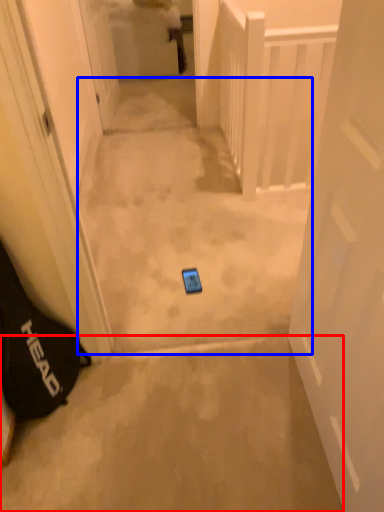
Question: Which point is further to the camera, concrete (highlighted by a red box) or path (highlighted by a blue box)?

Choices:
 (A) concrete
 (B) path

Answer: (B)